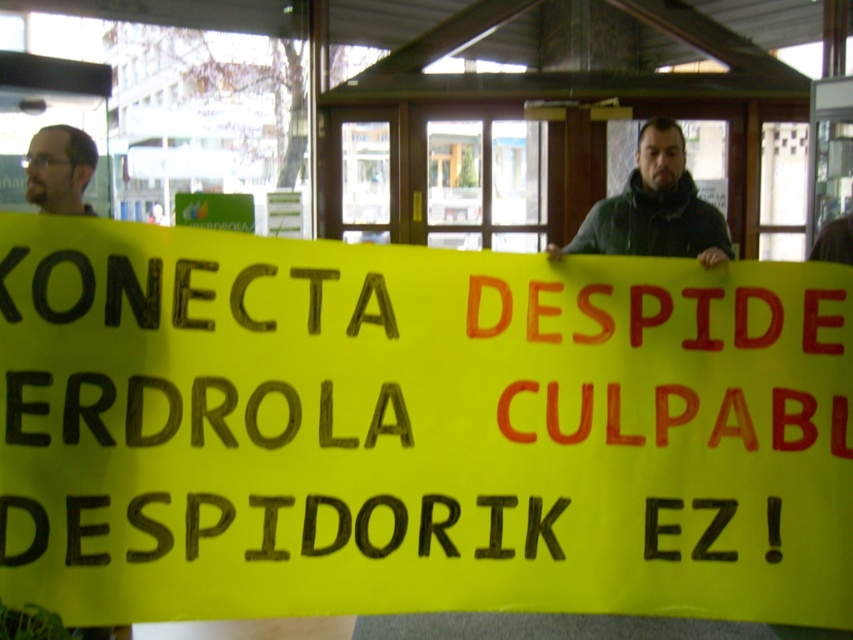
Is dark green jacket at center to the left of dark brown hair at upper left from the viewer's perspective?

In fact, dark green jacket at center is to the right of dark brown hair at upper left.

Who is more distant from viewer, [641,180] or [48,148]?

The point [641,180] is behind.

Does point (704, 214) come in front of point (68, 163)?

No, (704, 214) is further to viewer.

This screenshot has width=853, height=640. I want to click on dark green jacket at center, so click(654, 208).

Locate an element on the screen. This screenshot has height=640, width=853. yellow paper sign at center is located at coordinates (415, 429).

Can you confirm if yellow paper sign at center is bigger than dark green jacket at center?

Yes, yellow paper sign at center is bigger than dark green jacket at center.

Locate an element on the screen. The height and width of the screenshot is (640, 853). yellow paper sign at center is located at coordinates (415, 429).

Find the location of a particular element. The width and height of the screenshot is (853, 640). yellow paper sign at center is located at coordinates (415, 429).

Does yellow paper sign at center appear under dark brown hair at upper left?

Yes, yellow paper sign at center is below dark brown hair at upper left.

Is point (518, 500) farther from camera compared to point (57, 129)?

That is False.

Is point (16, 268) farther from viewer compared to point (86, 138)?

That is False.

The width and height of the screenshot is (853, 640). What are the coordinates of `yellow paper sign at center` in the screenshot? It's located at (415, 429).